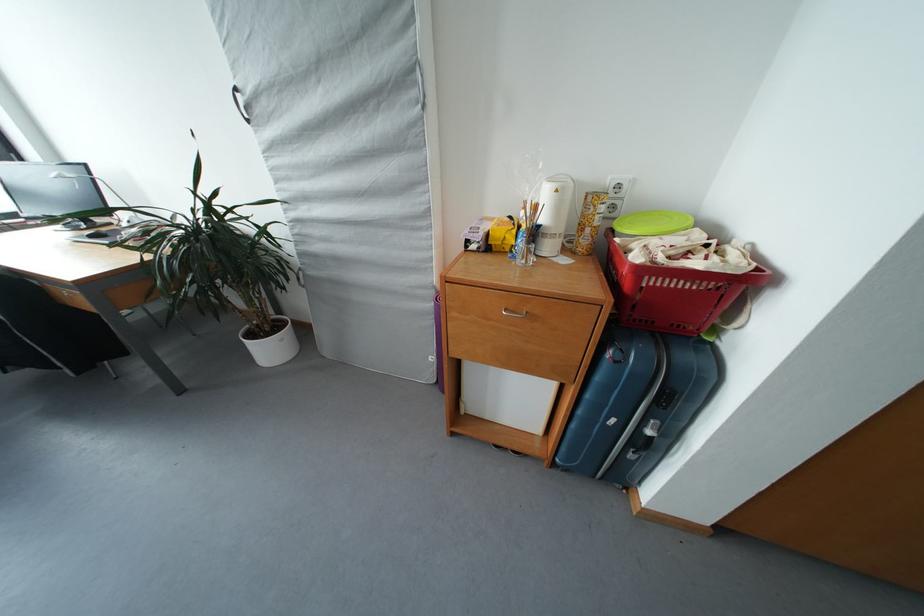
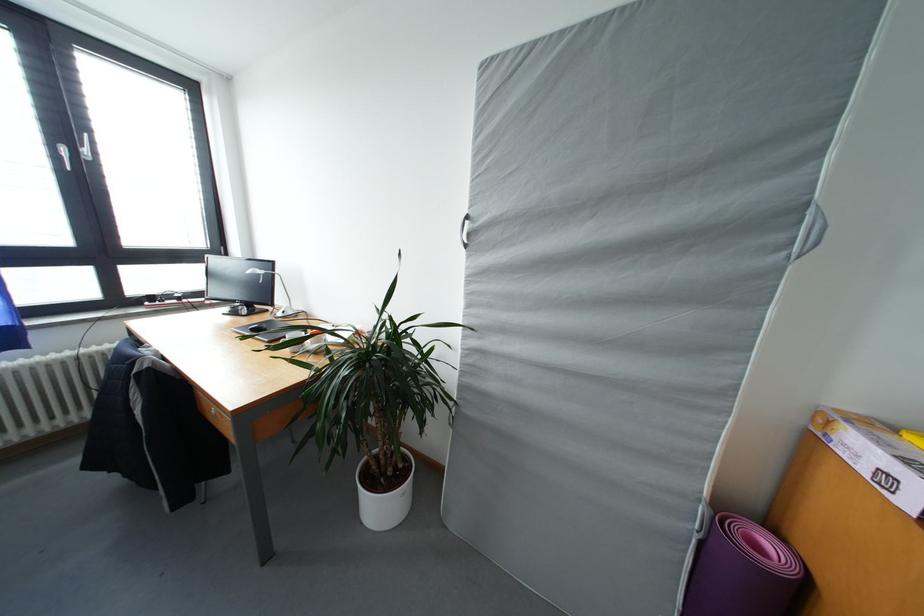
Find the pixel in the second image that matches point (242, 94) in the first image.

(473, 222)